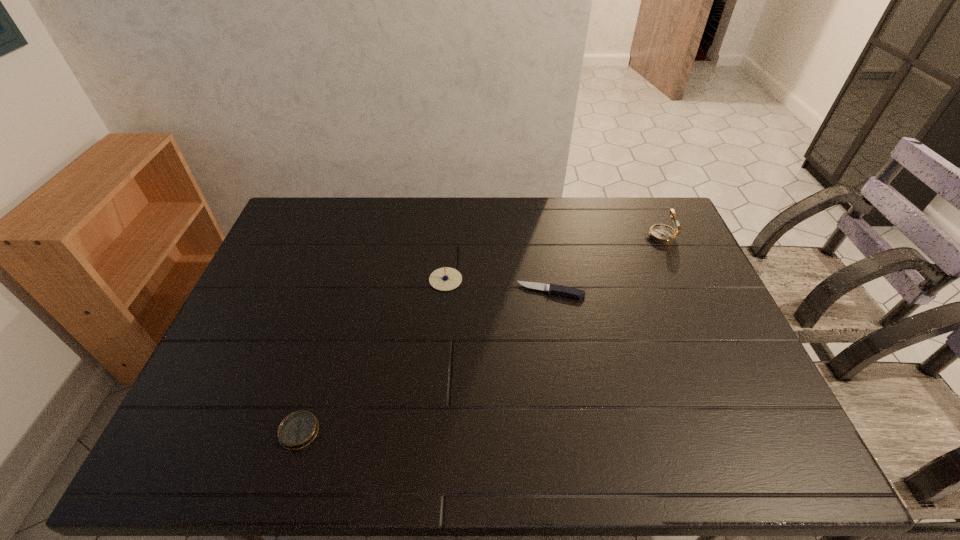
Locate an element on the screen. This screenshot has width=960, height=540. free space between the rightmost object and the second object from left to right is located at coordinates (553, 258).

Identify the location of vacant space that is in between the tallest compass and the nearest compass. (479, 334).

Locate which object ranks in proximity to the nearest compass. Please provide its 2D coordinates. Your answer should be formatted as a tuple, i.e. [(x, y)], where the tuple contains the x and y coordinates of a point satisfying the conditions above.

[(444, 279)]

Select which object appears as the third closest to the second tallest compass. Please provide its 2D coordinates. Your answer should be formatted as a tuple, i.e. [(x, y)], where the tuple contains the x and y coordinates of a point satisfying the conditions above.

[(663, 234)]

Image resolution: width=960 pixels, height=540 pixels. Identify the location of the closest compass relative to the rightmost compass. (444, 279).

Select which compass appears as the second closest to the second object from right to left. Please provide its 2D coordinates. Your answer should be formatted as a tuple, i.e. [(x, y)], where the tuple contains the x and y coordinates of a point satisfying the conditions above.

[(663, 234)]

The width and height of the screenshot is (960, 540). What are the coordinates of `vacant area in the image that satisfies the following two spatial constraints: 1. on the back side of the second object from right to left; 2. on the right side of the nearest object` in the screenshot? It's located at point(342,292).

Find the location of `vacant space that satisfies the following two spatial constraints: 1. on the back side of the leftmost object; 2. on the left side of the steak knife`. vacant space that satisfies the following two spatial constraints: 1. on the back side of the leftmost object; 2. on the left side of the steak knife is located at coordinates (x=342, y=292).

I want to click on vacant area in the image that satisfies the following two spatial constraints: 1. on the back side of the steak knife; 2. on the left side of the shortest compass, so click(342, 292).

This screenshot has height=540, width=960. Find the location of `blank area in the image that satisfies the following two spatial constraints: 1. with the dial facing the rightmost object; 2. on the front side of the shortest compass`. blank area in the image that satisfies the following two spatial constraints: 1. with the dial facing the rightmost object; 2. on the front side of the shortest compass is located at coordinates pos(747,431).